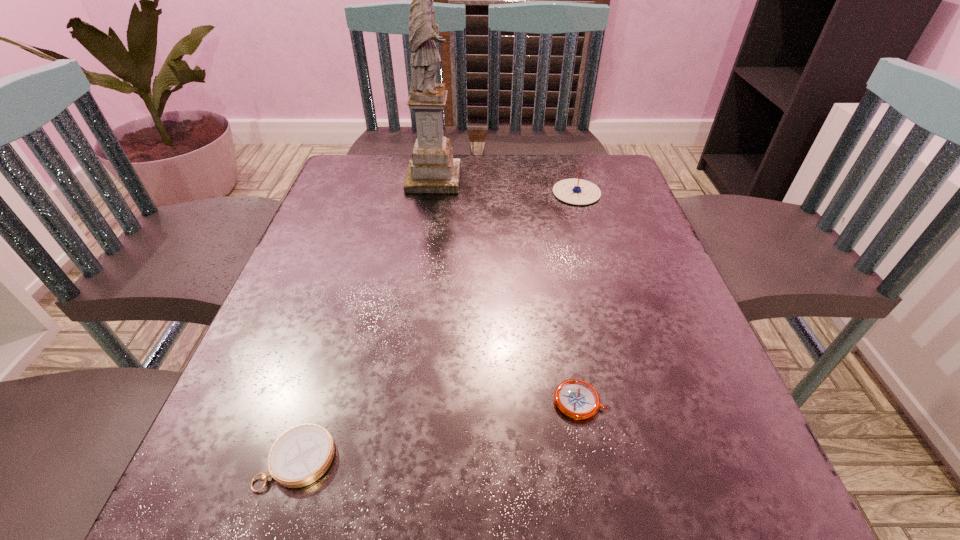
This screenshot has width=960, height=540. What are the coordinates of `free space at the near edge of the desktop` in the screenshot? It's located at (347, 532).

Identify the location of vacant space at the left edge of the desktop. The width and height of the screenshot is (960, 540). (376, 217).

I want to click on vacant space at the right edge, so click(633, 222).

In order to click on free space at the far left corner in this screenshot , I will do `click(359, 156)`.

Find the location of a particular element. The height and width of the screenshot is (540, 960). vacant area that lies between the farthest compass and the shortest compass is located at coordinates tap(578, 297).

I want to click on unoccupied position between the shortest object and the nearest object, so click(x=439, y=430).

At what (x,y) coordinates should I click in order to perform the action: click on free area in between the second object from left to right and the farthest compass. Please return your answer as a coordinate pair (x, y). This screenshot has height=540, width=960. Looking at the image, I should click on 505,186.

Where is `vacant space that is in between the second object from left to right and the farthest compass`? This screenshot has height=540, width=960. vacant space that is in between the second object from left to right and the farthest compass is located at coordinates click(x=505, y=186).

Locate an element on the screen. The image size is (960, 540). free spot between the third farthest object and the leftmost compass is located at coordinates (439, 430).

Locate an element on the screen. free space between the shortest object and the nearest compass is located at coordinates (439, 430).